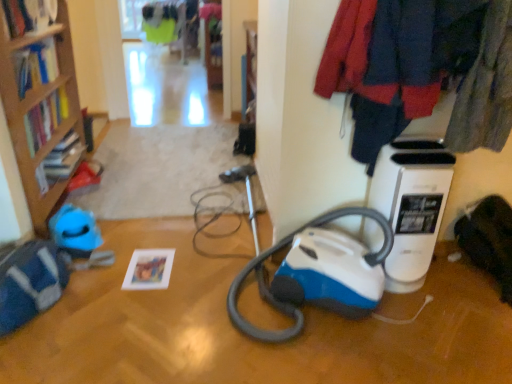
In order to face white plastic air purifier at right, should I rotate leftwards or rightwards?

To align with it, rotate right about 18.770°.

The height and width of the screenshot is (384, 512). What are the coordinates of `hardcover book at upper left, which is the 1th book in top-to-bottom order` in the screenshot? It's located at (29, 15).

How much space does matte paper photo frame at lower left, placed as the first book when sorted from right to left, occupy vertically?

The height of matte paper photo frame at lower left, placed as the first book when sorted from right to left, is 3.63 centimeters.

I want to click on white plastic air purifier at right, so click(411, 205).

Which of these two, velvet-like fabric coat at upper right or white plastic air purifier at right, is wider?

With larger width is velvet-like fabric coat at upper right.

Locate an element on the screen. home appliance that appears below the velvet-like fabric coat at upper right (from the image's perspective) is located at coordinates (411, 205).

From a real-world perspective, is velvet-like fabric coat at upper right positioned above or below white plastic air purifier at right?

From a real-world perspective, velvet-like fabric coat at upper right is physically above white plastic air purifier at right.

From the image's perspective, who appears lower, velvet-like fabric coat at upper right or white plastic air purifier at right?

white plastic air purifier at right is shown below in the image.

Does point (49, 133) appear closer or farther from the camera than point (391, 102)?

Point (49, 133) is positioned farther from the camera compared to point (391, 102).

From the image's perspective, relative to velvet-like fabric coat at upper right, is hardcover book at left, the second book when ordered from top to bottom, above or below?

From the image's perspective, hardcover book at left, the second book when ordered from top to bottom, appears above velvet-like fabric coat at upper right.

Is hardcover book at left, which ranks as the second book in right-to-left order, far from velvet-like fabric coat at upper right?

Yes, hardcover book at left, which ranks as the second book in right-to-left order, and velvet-like fabric coat at upper right are quite far apart.

From a real-world perspective, relative to velvet-like fabric coat at upper right, is hardcover book at left, the second book when ordered from top to bottom, vertically above or below?

hardcover book at left, the second book when ordered from top to bottom, is below velvet-like fabric coat at upper right.

Can you confirm if hardcover book at upper left, the first book positioned from the left, is thinner than matte paper photo frame at lower left, which is counted as the first book, starting from the bottom?

Correct, the width of hardcover book at upper left, the first book positioned from the left, is less than that of matte paper photo frame at lower left, which is counted as the first book, starting from the bottom.

How different are the orientations of hardcover book at upper left, which is the third book in right-to-left order, and matte paper photo frame at lower left, placed as the 3th book when sorted from top to bottom, in degrees?

The facing directions of hardcover book at upper left, which is the third book in right-to-left order, and matte paper photo frame at lower left, placed as the 3th book when sorted from top to bottom, are 93.6 degrees apart.

Between hardcover book at upper left, which is the 1th book in top-to-bottom order, and matte paper photo frame at lower left, which is counted as the first book, starting from the bottom, which one appears on the right side from the viewer's perspective?

Positioned to the right is matte paper photo frame at lower left, which is counted as the first book, starting from the bottom.

Which is in front, point (49, 17) or point (148, 273)?

The point (148, 273) is closer.

Does velvet-like fabric coat at upper right have a larger size compared to hardcover book at left, the second book when ordered from top to bottom?

Correct, velvet-like fabric coat at upper right is larger in size than hardcover book at left, the second book when ordered from top to bottom.

Considering the positions of objects velvet-like fabric coat at upper right and hardcover book at left, the second book when ordered from top to bottom, in the image provided, who is more to the right, velvet-like fabric coat at upper right or hardcover book at left, the second book when ordered from top to bottom,?

From the viewer's perspective, velvet-like fabric coat at upper right appears more on the right side.

Between point (471, 47) and point (52, 129), which one is positioned behind?

The point (52, 129) is more distant.

Does velvet-like fabric coat at upper right turn towards hardcover book at left, which ranks as the second book in right-to-left order?

No, velvet-like fabric coat at upper right does not turn towards hardcover book at left, which ranks as the second book in right-to-left order.

Who is bigger, hardcover book at left, the second book when ordered from top to bottom, or matte paper photo frame at lower left, placed as the first book when sorted from right to left?

Bigger between the two is hardcover book at left, the second book when ordered from top to bottom.

Can you confirm if hardcover book at left, which ranks as the second book in right-to-left order, is wider than matte paper photo frame at lower left, placed as the first book when sorted from right to left?

No.

From a real-world perspective, is hardcover book at left, arranged as the second book when viewed from the left, above or below matte paper photo frame at lower left, which is counted as the first book, starting from the bottom?

hardcover book at left, arranged as the second book when viewed from the left, is situated higher than matte paper photo frame at lower left, which is counted as the first book, starting from the bottom, in the real world.

Is white plastic air purifier at right located outside wooden bookcase at left?

That's correct, white plastic air purifier at right is outside of wooden bookcase at left.

From the image's perspective, relative to wooden bookcase at left, is white plastic air purifier at right above or below?

white plastic air purifier at right is below wooden bookcase at left.

Is white plastic air purifier at right placed right next to wooden bookcase at left?

No.

Based on the photo, is matte paper photo frame at lower left, placed as the first book when sorted from right to left, taller than hardcover book at upper left, the first book positioned from the left?

No, matte paper photo frame at lower left, placed as the first book when sorted from right to left, is not taller than hardcover book at upper left, the first book positioned from the left.

From the picture: Is matte paper photo frame at lower left, placed as the 3th book when sorted from top to bottom, not close to hardcover book at upper left, which is the 1th book in top-to-bottom order?

Yes, matte paper photo frame at lower left, placed as the 3th book when sorted from top to bottom, and hardcover book at upper left, which is the 1th book in top-to-bottom order, are located far from each other.

Is hardcover book at upper left, which is the third book in right-to-left order, located within matte paper photo frame at lower left, placed as the first book when sorted from right to left?

No, hardcover book at upper left, which is the third book in right-to-left order, is located outside of matte paper photo frame at lower left, placed as the first book when sorted from right to left.

At what (x,y) coordinates should I click in order to perform the action: click on the 2nd book to the right of the hardcover book at upper left, which is the third book in right-to-left order, starting your count from the anchor. Please return your answer as a coordinate pair (x, y). This screenshot has width=512, height=384. Looking at the image, I should click on (149, 269).

This screenshot has height=384, width=512. Identify the location of home appliance behind the velvet-like fabric coat at upper right. (411, 205).

In the image, there is a hardcover book at left, which ranks as the second book in right-to-left order. Identify the location of clothing below it (from the image's perspective). The image size is (512, 384). (421, 69).

Considering their positions, is white plastic air purifier at right positioned closer to velvet-like fabric coat at upper right than matte paper photo frame at lower left, placed as the 3th book when sorted from top to bottom?

white plastic air purifier at right lies closer to velvet-like fabric coat at upper right than the other object.

Looking at the image, which one is located further to velvet-like fabric coat at upper right, hardcover book at upper left, the first book positioned from the left, or wooden bookcase at left?

Among the two, hardcover book at upper left, the first book positioned from the left, is located further to velvet-like fabric coat at upper right.

Considering their positions, is hardcover book at upper left, the first book positioned from the left, positioned further to wooden bookcase at left than hardcover book at left, the second book when ordered from top to bottom?

hardcover book at upper left, the first book positioned from the left.

Looking at the image, which one is located closer to white plastic air purifier at right, hardcover book at upper left, which is counted as the third book, starting from the bottom, or velvet-like fabric coat at upper right?

velvet-like fabric coat at upper right.

From the image, which object appears to be farther from hardcover book at left, which ranks as the second book in right-to-left order, wooden bookcase at left or velvet-like fabric coat at upper right?

Based on the image, velvet-like fabric coat at upper right appears to be further to hardcover book at left, which ranks as the second book in right-to-left order.

From the image, which object appears to be nearer to matte paper photo frame at lower left, placed as the first book when sorted from right to left, white plastic air purifier at right or velvet-like fabric coat at upper right?

white plastic air purifier at right.

Looking at the image, which one is located further to matte paper photo frame at lower left, placed as the 3th book when sorted from top to bottom, hardcover book at upper left, which is the third book in right-to-left order, or hardcover book at left, placed as the second book when sorted from bottom to top?

hardcover book at upper left, which is the third book in right-to-left order, is positioned further to the anchor matte paper photo frame at lower left, placed as the 3th book when sorted from top to bottom.

Considering their positions, is velvet-like fabric coat at upper right positioned closer to white plastic air purifier at right than wooden bookcase at left?

velvet-like fabric coat at upper right lies closer to white plastic air purifier at right than the other object.

Locate an element on the screen. This screenshot has width=512, height=384. bookcase between hardcover book at left, which ranks as the second book in right-to-left order, and matte paper photo frame at lower left, which is counted as the first book, starting from the bottom, from top to bottom is located at coordinates (40, 105).

Where is `bookcase between hardcover book at upper left, which is the third book in right-to-left order, and matte paper photo frame at lower left, placed as the 3th book when sorted from left to right, in the up-down direction`? The width and height of the screenshot is (512, 384). bookcase between hardcover book at upper left, which is the third book in right-to-left order, and matte paper photo frame at lower left, placed as the 3th book when sorted from left to right, in the up-down direction is located at coordinates (40, 105).

Find the location of `book between hardcover book at upper left, which is counted as the third book, starting from the bottom, and matte paper photo frame at lower left, placed as the 3th book when sorted from top to bottom, vertically`. book between hardcover book at upper left, which is counted as the third book, starting from the bottom, and matte paper photo frame at lower left, placed as the 3th book when sorted from top to bottom, vertically is located at coordinates (45, 119).

Identify the location of bookcase between hardcover book at upper left, which is the third book in right-to-left order, and white plastic air purifier at right from left to right. Image resolution: width=512 pixels, height=384 pixels. (40, 105).